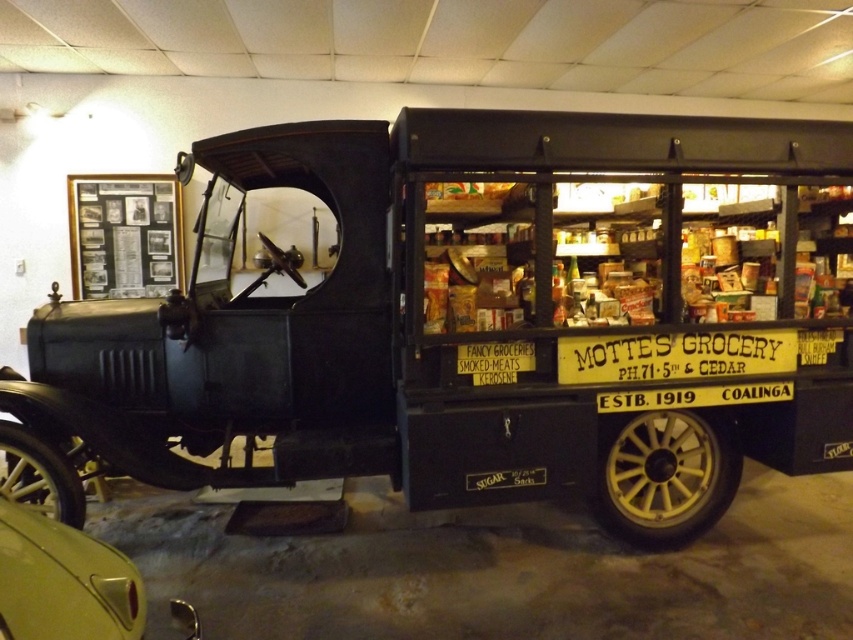
Question: Is matte black truck at center further to the viewer compared to metallic gold car at lower left?

Choices:
 (A) yes
 (B) no

Answer: (A)

Question: Considering the relative positions of matte black truck at center and metallic gold car at lower left in the image provided, where is matte black truck at center located with respect to metallic gold car at lower left?

Choices:
 (A) above
 (B) below

Answer: (A)

Question: Does matte black truck at center lie in front of metallic gold car at lower left?

Choices:
 (A) no
 (B) yes

Answer: (A)

Question: Which point is farther from the camera taking this photo?

Choices:
 (A) (636, 118)
 (B) (79, 624)

Answer: (A)